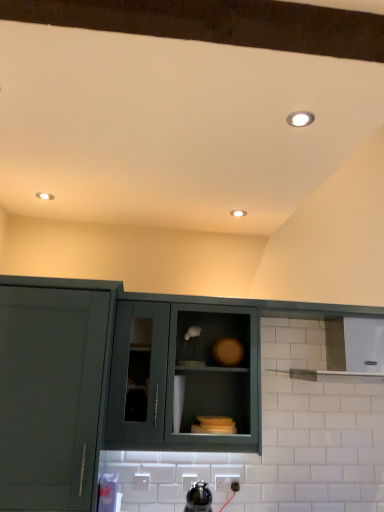
Describe the element at coordinates (238, 213) in the screenshot. I see `matte white recessed light at center` at that location.

I want to click on matte white recessed light at center, so click(x=238, y=213).

Identify the location of white glossy light fixture at upper right. Image resolution: width=384 pixels, height=512 pixels. (300, 118).

The image size is (384, 512). What do you see at coordinates (53, 389) in the screenshot? I see `matte green cabinet at left, the third cabinetry viewed from the right` at bounding box center [53, 389].

Where is `matte green cabinet at center, the second cabinetry in the left-to-right sequence`? The height and width of the screenshot is (512, 384). matte green cabinet at center, the second cabinetry in the left-to-right sequence is located at coordinates (184, 377).

From a real-world perspective, which object rests below the other?

white plastic electric outlet at lower center, from a real-world perspective.

Can you confirm if matte green cabinet at center, the second cabinetry in the left-to-right sequence, is bigger than white plastic electric outlet at lower center?

Yes.

How different are the orientations of matte green cabinet at center, the second cabinetry in the left-to-right sequence, and white plastic electric outlet at lower center in degrees?

The angular difference between matte green cabinet at center, the second cabinetry in the left-to-right sequence, and white plastic electric outlet at lower center is 1.82 degrees.

At what (x,y) coordinates should I click in order to perform the action: click on the 3rd cabinetry positioned above the white plastic electric outlet at lower center (from a real-world perspective). Please return your answer as a coordinate pair (x, y). Image resolution: width=384 pixels, height=512 pixels. Looking at the image, I should click on click(x=184, y=377).

From the image's perspective, would you say matte white recessed light at center is positioned over matte green cabinet at center, arranged as the 3th cabinetry when viewed from the left?

Yes, from the image's perspective, matte white recessed light at center is over matte green cabinet at center, arranged as the 3th cabinetry when viewed from the left.

In the scene shown: Could you measure the distance between matte white recessed light at center and matte green cabinet at center, the 1th cabinetry in the right-to-left sequence?

They are 1.17 meters apart.

Identify the location of lighting behind the matte green cabinet at center, arranged as the 3th cabinetry when viewed from the left. (238, 213).

Looking at this image, is the depth of matte white recessed light at center less than that of white glossy light fixture at upper right?

No, matte white recessed light at center is further to the viewer.

Are matte white recessed light at center and white glossy light fixture at upper right beside each other?

No, matte white recessed light at center is not beside white glossy light fixture at upper right.

Can we say matte white recessed light at center lies outside white glossy light fixture at upper right?

Yes, matte white recessed light at center is located beyond the bounds of white glossy light fixture at upper right.

Which of these two, matte white recessed light at center or white glossy light fixture at upper right, stands taller?

Result: Standing taller between the two is matte white recessed light at center.

Which of these two, white glossy light fixture at upper right or matte green cabinet at center, arranged as the 3th cabinetry when viewed from the left, is wider?

white glossy light fixture at upper right is wider.

Choose the correct answer: Is white glossy light fixture at upper right inside matte green cabinet at center, arranged as the 3th cabinetry when viewed from the left, or outside it?

white glossy light fixture at upper right is spatially situated outside matte green cabinet at center, arranged as the 3th cabinetry when viewed from the left.

From a real-world perspective, is white glossy light fixture at upper right physically located above or below matte green cabinet at center, the 1th cabinetry in the right-to-left sequence?

white glossy light fixture at upper right is above matte green cabinet at center, the 1th cabinetry in the right-to-left sequence.

Identify the location of light fixture above the matte green cabinet at center, arranged as the 3th cabinetry when viewed from the left (from a real-world perspective). The height and width of the screenshot is (512, 384). (300, 118).

I want to click on electric outlet on the left of matte green cabinet at center, arranged as the 3th cabinetry when viewed from the left, so click(x=227, y=483).

Are white plastic electric outlet at lower center and matte green cabinet at center, arranged as the 3th cabinetry when viewed from the left, making contact?

white plastic electric outlet at lower center and matte green cabinet at center, arranged as the 3th cabinetry when viewed from the left, are clearly separated.

From a real-world perspective, relative to matte green cabinet at center, the 1th cabinetry in the right-to-left sequence, is white plastic electric outlet at lower center vertically above or below?

white plastic electric outlet at lower center is below matte green cabinet at center, the 1th cabinetry in the right-to-left sequence.

Is white plastic electric outlet at lower center facing away from matte green cabinet at center, arranged as the 3th cabinetry when viewed from the left?

Correct, white plastic electric outlet at lower center is looking away from matte green cabinet at center, arranged as the 3th cabinetry when viewed from the left.

Does matte green cabinet at center, the 1th cabinetry in the right-to-left sequence, appear on the left side of matte green cabinet at center, the second cabinetry from the right?

No.

In terms of height, does matte green cabinet at center, the 1th cabinetry in the right-to-left sequence, look taller or shorter compared to matte green cabinet at center, the second cabinetry from the right?

In the image, matte green cabinet at center, the 1th cabinetry in the right-to-left sequence, appears to be taller than matte green cabinet at center, the second cabinetry from the right.

From the matte green cabinet at center, the 1th cabinetry in the right-to-left sequence, count 1st cabinetrys forward and point to it. Please provide its 2D coordinates.

[(184, 377)]

Can you confirm if matte green cabinet at center, arranged as the 3th cabinetry when viewed from the left, is smaller than matte green cabinet at center, the second cabinetry from the right?

Indeed, matte green cabinet at center, arranged as the 3th cabinetry when viewed from the left, has a smaller size compared to matte green cabinet at center, the second cabinetry from the right.

The height and width of the screenshot is (512, 384). In order to click on lighting above the matte green cabinet at center, the second cabinetry in the left-to-right sequence (from the image's perspective) in this screenshot , I will do `click(238, 213)`.

Between matte white recessed light at center and matte green cabinet at center, the second cabinetry from the right, which one appears on the left side from the viewer's perspective?

matte green cabinet at center, the second cabinetry from the right.

From the image's perspective, is matte white recessed light at center positioned above or below matte green cabinet at center, the second cabinetry in the left-to-right sequence?

Clearly, from the image's perspective, matte white recessed light at center is above matte green cabinet at center, the second cabinetry in the left-to-right sequence.

Between matte white recessed light at center and matte green cabinet at center, the second cabinetry in the left-to-right sequence, which one is positioned behind?

matte white recessed light at center is more distant.

In order to click on electric outlet that appears below the matte green cabinet at center, the second cabinetry in the left-to-right sequence (from the image's perspective) in this screenshot , I will do click(227, 483).

I want to click on lighting behind the matte green cabinet at center, the 1th cabinetry in the right-to-left sequence, so click(x=238, y=213).

Estimate the real-world distances between objects in this image. Which object is closer to matte green cabinet at center, arranged as the 3th cabinetry when viewed from the left, matte green cabinet at left, the third cabinetry viewed from the right, or matte white recessed light at center?

matte green cabinet at left, the third cabinetry viewed from the right, lies closer to matte green cabinet at center, arranged as the 3th cabinetry when viewed from the left, than the other object.

Estimate the real-world distances between objects in this image. Which object is further from white glossy light fixture at upper right, matte green cabinet at left, the third cabinetry viewed from the right, or matte white recessed light at center?

Among the two, matte green cabinet at left, the third cabinetry viewed from the right, is located further to white glossy light fixture at upper right.

Which object lies further to the anchor point matte white recessed light at center, matte green cabinet at center, the second cabinetry from the right, or matte green cabinet at center, the 1th cabinetry in the right-to-left sequence?

Among the two, matte green cabinet at center, the 1th cabinetry in the right-to-left sequence, is located further to matte white recessed light at center.

Considering their positions, is matte green cabinet at center, arranged as the 3th cabinetry when viewed from the left, positioned closer to white glossy light fixture at upper right than matte green cabinet at left, the third cabinetry viewed from the right?

Among the two, matte green cabinet at left, the third cabinetry viewed from the right, is located nearer to white glossy light fixture at upper right.

Looking at the image, which one is located further to white plastic electric outlet at lower center, matte green cabinet at left, the first cabinetry viewed from the left, or matte green cabinet at center, the second cabinetry in the left-to-right sequence?

Based on the image, matte green cabinet at left, the first cabinetry viewed from the left, appears to be further to white plastic electric outlet at lower center.

When comparing their distances from white plastic electric outlet at lower center, does matte green cabinet at center, arranged as the 3th cabinetry when viewed from the left, or white glossy light fixture at upper right seem further?

white glossy light fixture at upper right.

Estimate the real-world distances between objects in this image. Which object is closer to matte white recessed light at center, matte green cabinet at center, arranged as the 3th cabinetry when viewed from the left, or matte green cabinet at center, the second cabinetry in the left-to-right sequence?

matte green cabinet at center, the second cabinetry in the left-to-right sequence.

Which object lies further to the anchor point matte green cabinet at center, the second cabinetry from the right, matte green cabinet at left, the first cabinetry viewed from the left, or white plastic electric outlet at lower center?

The object further to matte green cabinet at center, the second cabinetry from the right, is white plastic electric outlet at lower center.

Find the location of a particular element. Image resolution: width=384 pixels, height=512 pixels. cabinetry between matte white recessed light at center and matte green cabinet at left, the third cabinetry viewed from the right, vertically is located at coordinates (184, 377).

The height and width of the screenshot is (512, 384). Find the location of `lighting between white glossy light fixture at upper right and matte green cabinet at left, the first cabinetry viewed from the left, vertically`. lighting between white glossy light fixture at upper right and matte green cabinet at left, the first cabinetry viewed from the left, vertically is located at coordinates (238, 213).

Find the location of `lighting between white glossy light fixture at upper right and matte green cabinet at center, the second cabinetry in the left-to-right sequence, from top to bottom`. lighting between white glossy light fixture at upper right and matte green cabinet at center, the second cabinetry in the left-to-right sequence, from top to bottom is located at coordinates (238, 213).

Find the location of a particular element. Image resolution: width=384 pixels, height=512 pixels. lighting between matte green cabinet at left, the first cabinetry viewed from the left, and matte green cabinet at center, arranged as the 3th cabinetry when viewed from the left is located at coordinates (238, 213).